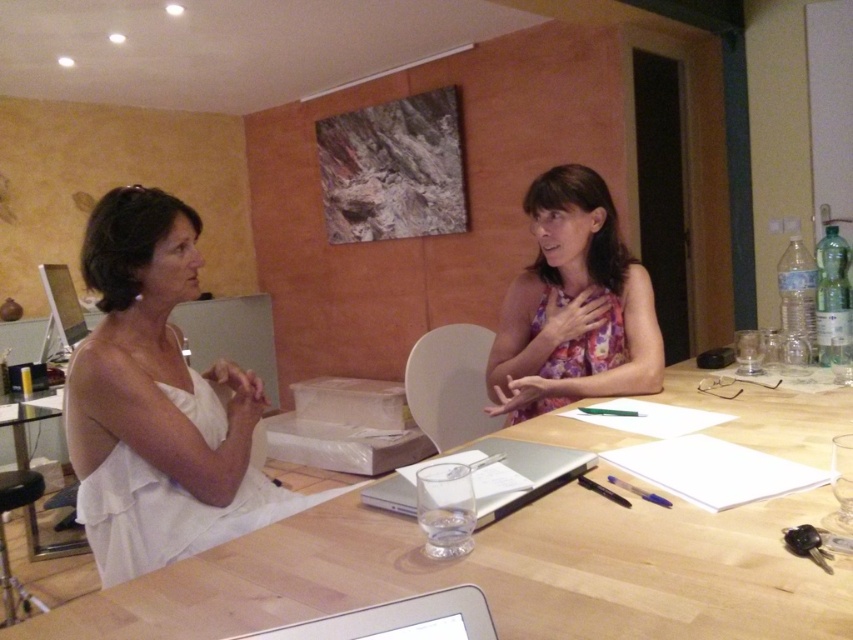
Image resolution: width=853 pixels, height=640 pixels. Find the location of `floral fabric dress at center`. floral fabric dress at center is located at coordinates (573, 305).

Between floral fabric dress at center and silver metallic laptop at center, which one has less height?

With less height is silver metallic laptop at center.

Between point (592, 288) and point (532, 465), which one is positioned in front?

Positioned in front is point (532, 465).

In order to click on floral fabric dress at center in this screenshot , I will do `click(573, 305)`.

Is white satin dress at left in front of floral fabric dress at center?

That is True.

Is point (83, 520) closer to camera compared to point (647, 276)?

Yes, point (83, 520) is closer to viewer.

At what (x,y) coordinates should I click in order to perform the action: click on white satin dress at left. Please return your answer as a coordinate pair (x, y). The image size is (853, 640). Looking at the image, I should click on (157, 403).

Is point (466, 618) closer to viewer compared to point (500, 515)?

Yes.

Does white glossy laptop at center lie in front of silver metallic laptop at center?

Yes, it is in front of silver metallic laptop at center.

Is point (374, 630) farther from camera compared to point (387, 500)?

No, (374, 630) is closer to viewer.

The image size is (853, 640). I want to click on white glossy laptop at center, so click(399, 620).